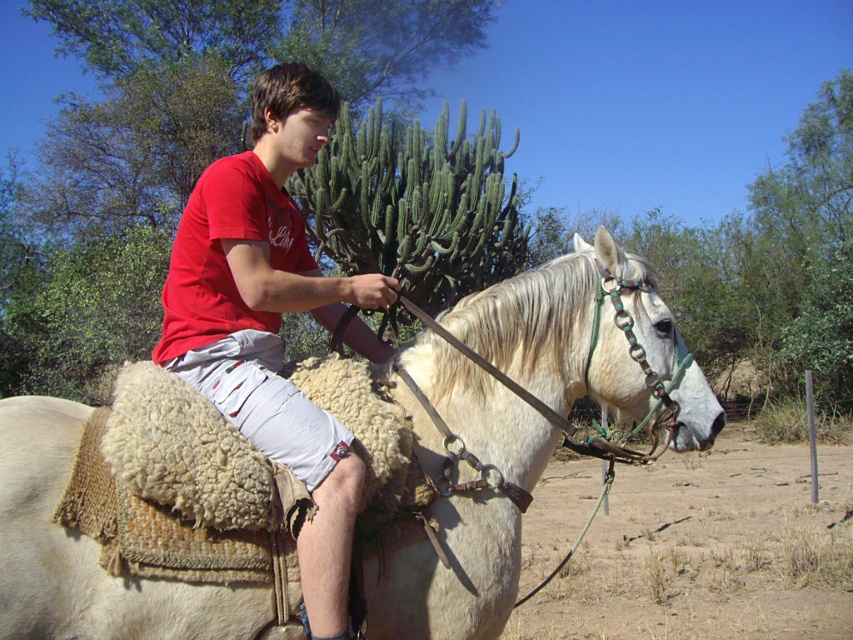
Question: Does white woolen saddle at center have a larger size compared to matte red t-shirt at center?

Choices:
 (A) yes
 (B) no

Answer: (B)

Question: From the image, what is the correct spatial relationship of white woolen saddle at center in relation to matte red t-shirt at center?

Choices:
 (A) above
 (B) below

Answer: (B)

Question: Is white woolen saddle at center positioned at the back of matte red t-shirt at center?

Choices:
 (A) yes
 (B) no

Answer: (A)

Question: Which of the following is the closest to the observer?

Choices:
 (A) matte red t-shirt at center
 (B) white woolen saddle at center

Answer: (A)